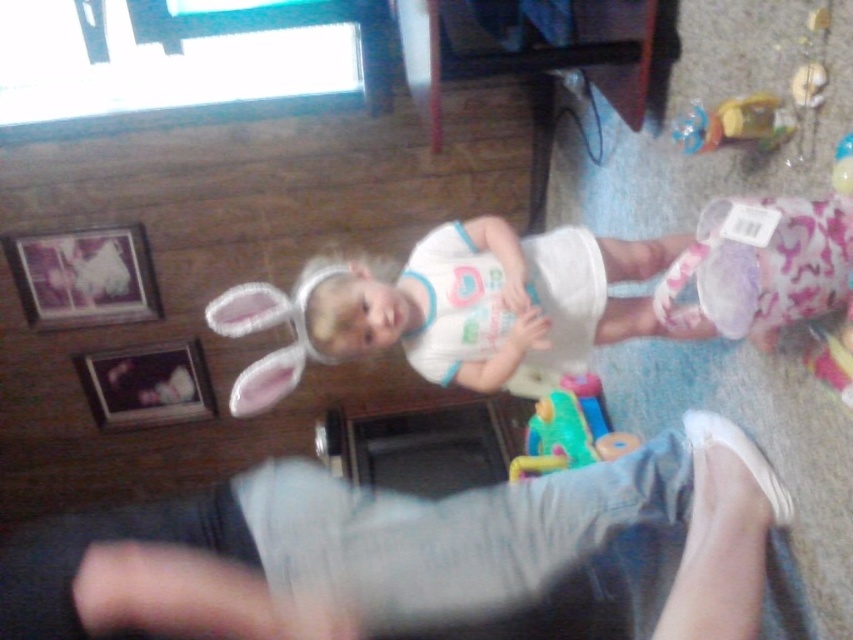
Question: Does metallic silver picture frame at upper left have a larger size compared to rubberized green toy at center?

Choices:
 (A) yes
 (B) no

Answer: (B)

Question: Among these objects, which one is nearest to the camera?

Choices:
 (A) metallic silver picture frame at upper left
 (B) white fabric bunny ears at center
 (C) rubberized green toy at center
 (D) wooden picture frame at left

Answer: (B)

Question: Based on their relative distances, which object is nearer to the metallic silver picture frame at upper left?

Choices:
 (A) white fabric bunny ears at center
 (B) wooden picture frame at left

Answer: (B)

Question: Observing the image, what is the correct spatial positioning of white fabric bunny ears at center in reference to metallic silver picture frame at upper left?

Choices:
 (A) below
 (B) above

Answer: (A)

Question: Is metallic silver picture frame at upper left bigger than wooden picture frame at left?

Choices:
 (A) no
 (B) yes

Answer: (B)

Question: Which point is farther to the camera?

Choices:
 (A) wooden picture frame at left
 (B) rubberized green toy at center

Answer: (A)